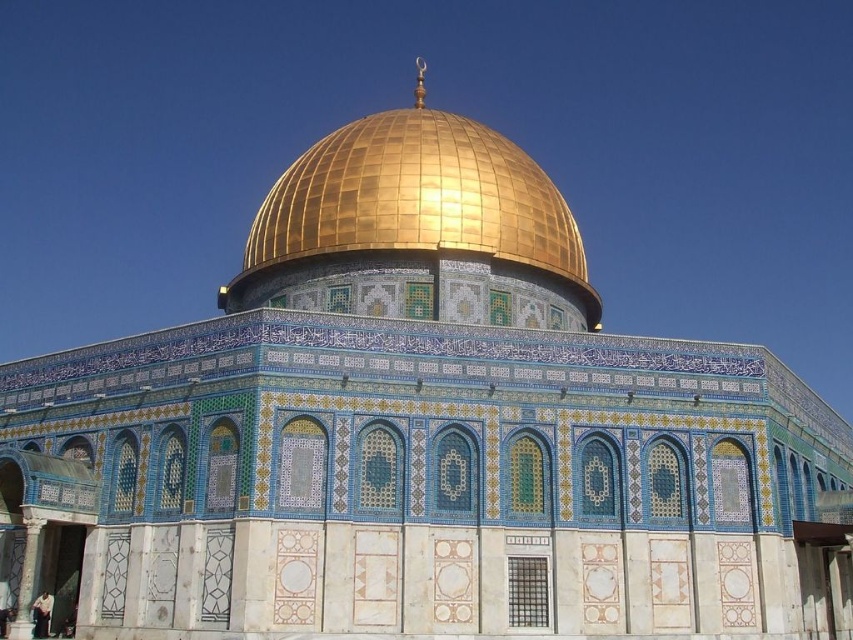
Question: Does gold mosaic dome at center appear over dark blue fabric at lower left?

Choices:
 (A) yes
 (B) no

Answer: (A)

Question: Observing the image, what is the correct spatial positioning of gold mosaic dome at center in reference to dark blue fabric at lower left?

Choices:
 (A) right
 (B) left

Answer: (A)

Question: Which of the following is the farthest from the observer?

Choices:
 (A) gold mosaic dome at center
 (B) dark blue fabric at lower left

Answer: (A)

Question: Where is gold mosaic dome at center located in relation to dark blue fabric at lower left in the image?

Choices:
 (A) left
 (B) right

Answer: (B)

Question: Which point appears closest to the camera in this image?

Choices:
 (A) (38, 614)
 (B) (438, 294)

Answer: (A)

Question: Among these objects, which one is farthest from the camera?

Choices:
 (A) dark blue fabric at lower left
 (B) gold mosaic dome at center

Answer: (B)